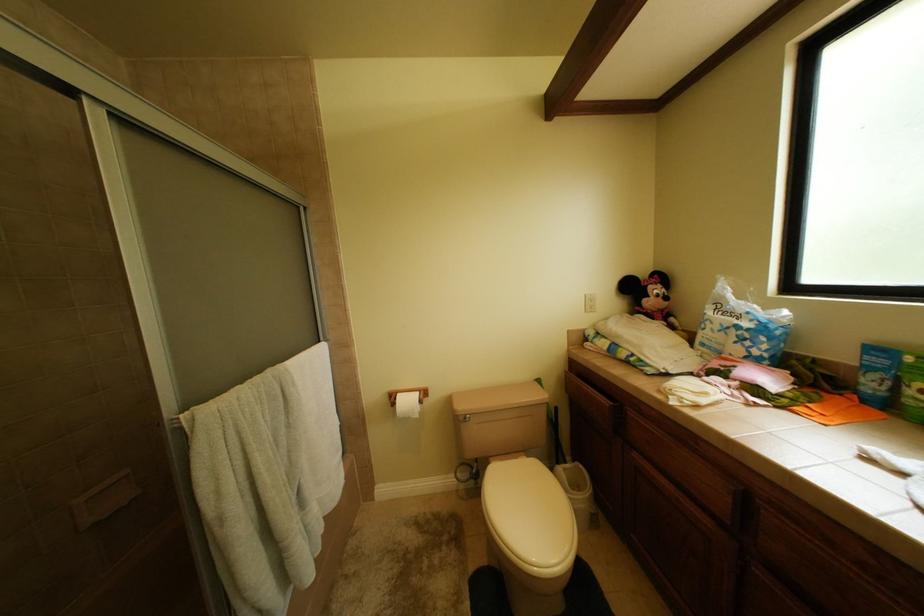
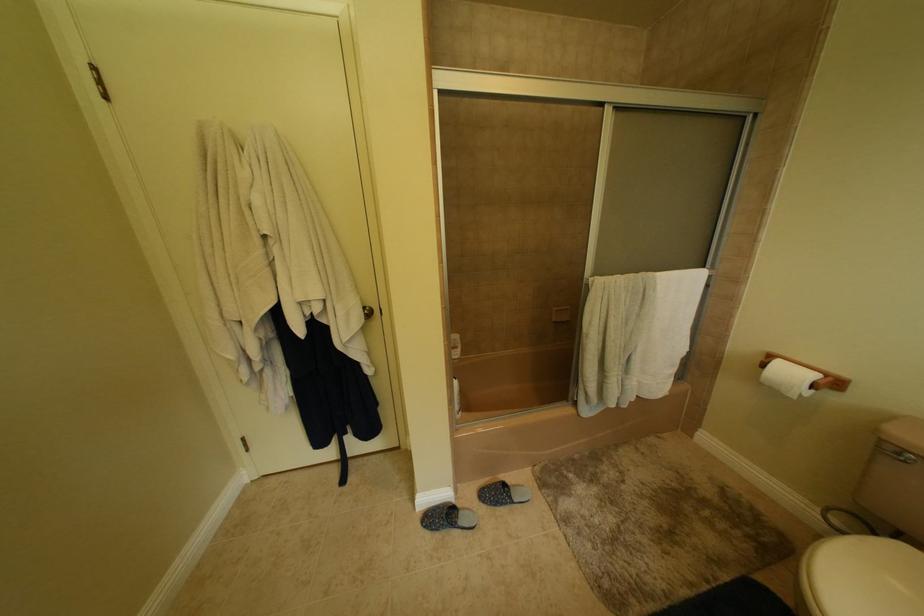
Based on the continuous images, in which direction is the camera rotating?

The camera rotated toward left-down.